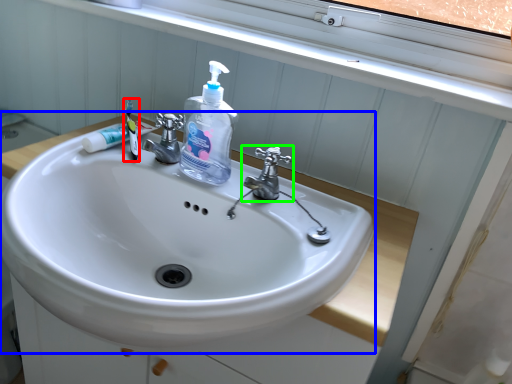
Question: Which is nearer to the toothbrush (highlighted by a red box)? sink (highlighted by a blue box) or tap (highlighted by a green box).

Choices:
 (A) sink
 (B) tap

Answer: (A)